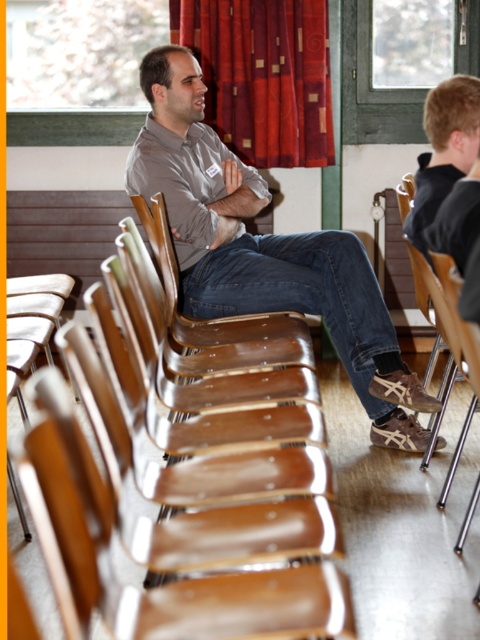
Between brown leather shoes at center and black fabric shirt at right, which one appears on the right side from the viewer's perspective?

From the viewer's perspective, black fabric shirt at right appears more on the right side.

Which is behind, point (173, 83) or point (420, 166)?

Point (173, 83)

At what (x,y) coordinates should I click in order to perform the action: click on brown leather shoes at center. Please return your answer as a coordinate pair (x, y). This screenshot has height=640, width=480. Looking at the image, I should click on (264, 248).

Can you confirm if red velvet curtain at upper center is positioned to the left of black fabric shirt at right?

Indeed, red velvet curtain at upper center is positioned on the left side of black fabric shirt at right.

Who is lower down, red velvet curtain at upper center or black fabric shirt at right?

Positioned lower is black fabric shirt at right.

Which is in front, point (224, 60) or point (434, 179)?

Positioned in front is point (434, 179).

This screenshot has width=480, height=640. I want to click on red velvet curtain at upper center, so click(263, 76).

Which is more to the right, brown leather shoes at center or red velvet curtain at upper center?

From the viewer's perspective, red velvet curtain at upper center appears more on the right side.

Between brown leather shoes at center and red velvet curtain at upper center, which one appears on the left side from the viewer's perspective?

brown leather shoes at center

At what (x,y) coordinates should I click in order to perform the action: click on brown leather shoes at center. Please return your answer as a coordinate pair (x, y). Looking at the image, I should click on (264, 248).